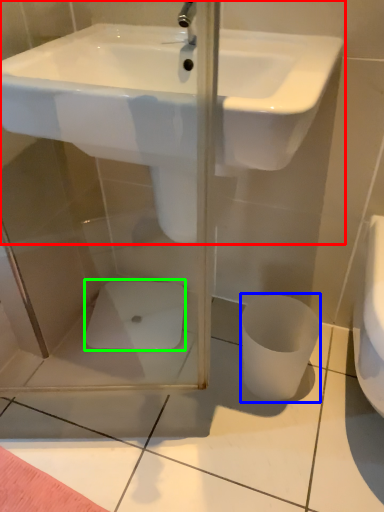
Question: Which object is the farthest from sink (highlighted by a red box)? Choose among these: toilet bowl (highlighted by a blue box) or porcelain (highlighted by a green box).

Choices:
 (A) toilet bowl
 (B) porcelain

Answer: (B)